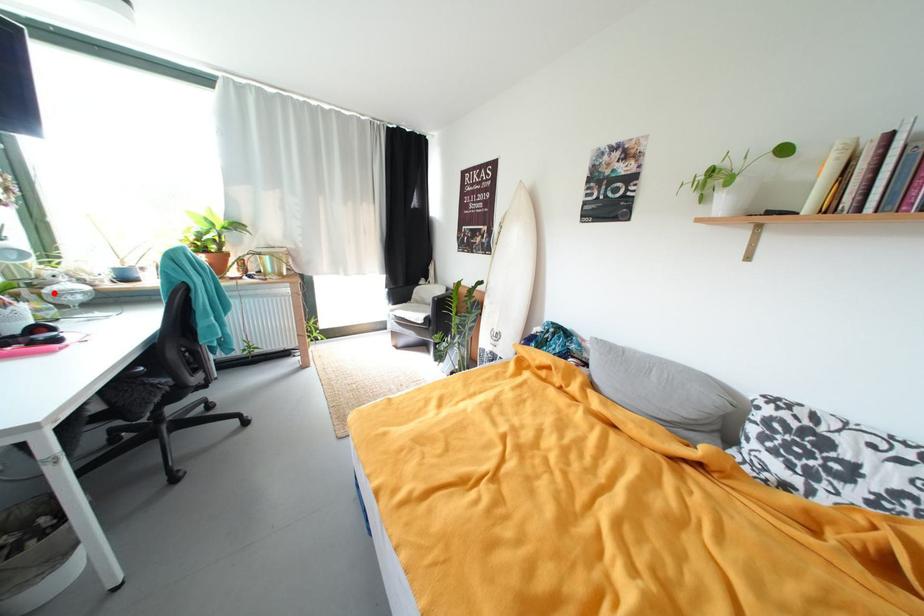
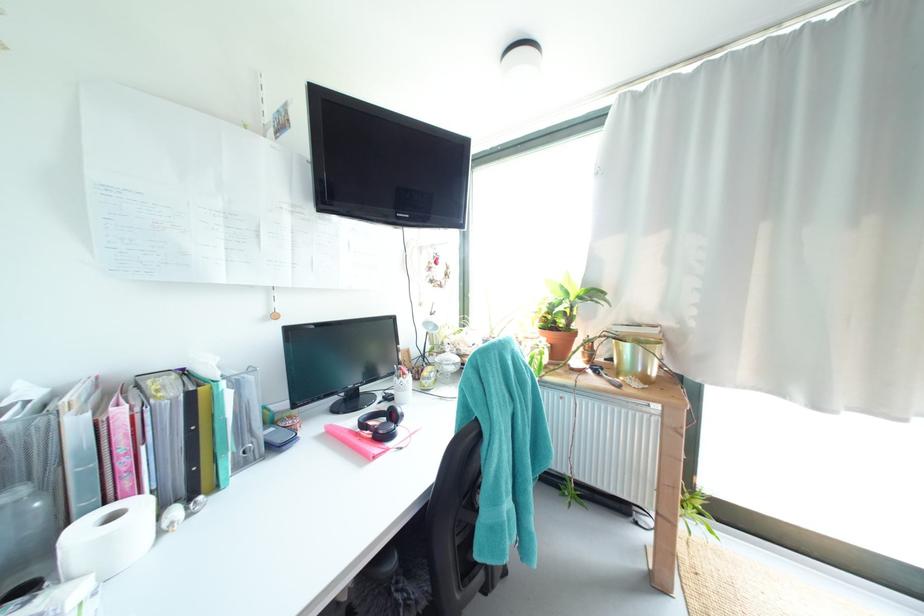
Where in the second image is the point corresponding to the highlighted location from the first image?

(445, 361)